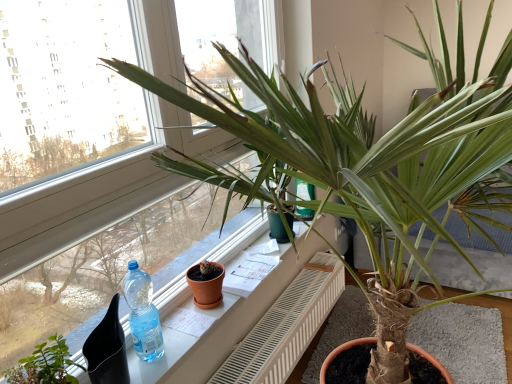
Image resolution: width=512 pixels, height=384 pixels. Identify the location of free spot in front of terracotta clay pot at center. (191, 324).